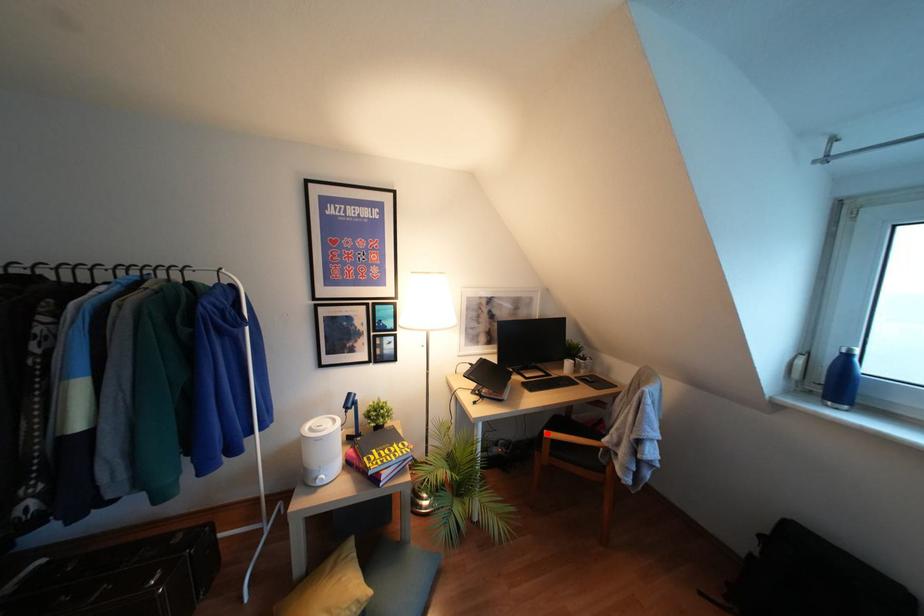
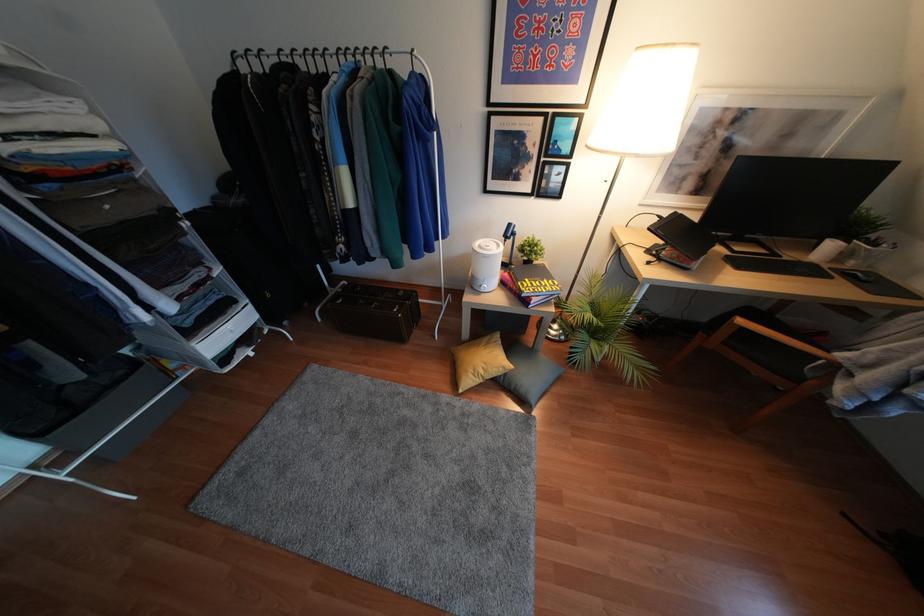
The point at the highlighted location is marked in the first image. Where is the corresponding point in the second image?

(739, 321)